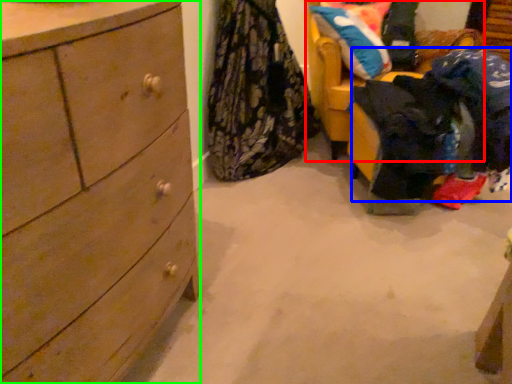
Question: Estimate the real-world distances between objects in this image. Which object is closer to furniture (highlighted by a red box), clothing (highlighted by a blue box) or chest of drawers (highlighted by a green box)?

Choices:
 (A) clothing
 (B) chest of drawers

Answer: (A)